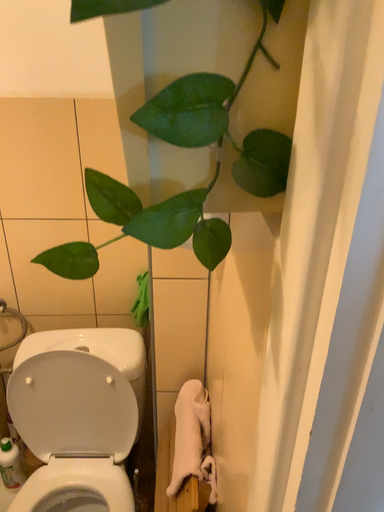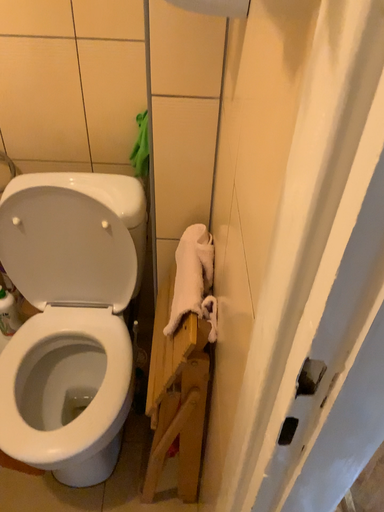
Question: How did the camera likely rotate when shooting the video?

Choices:
 (A) rotated downward
 (B) rotated upward

Answer: (A)